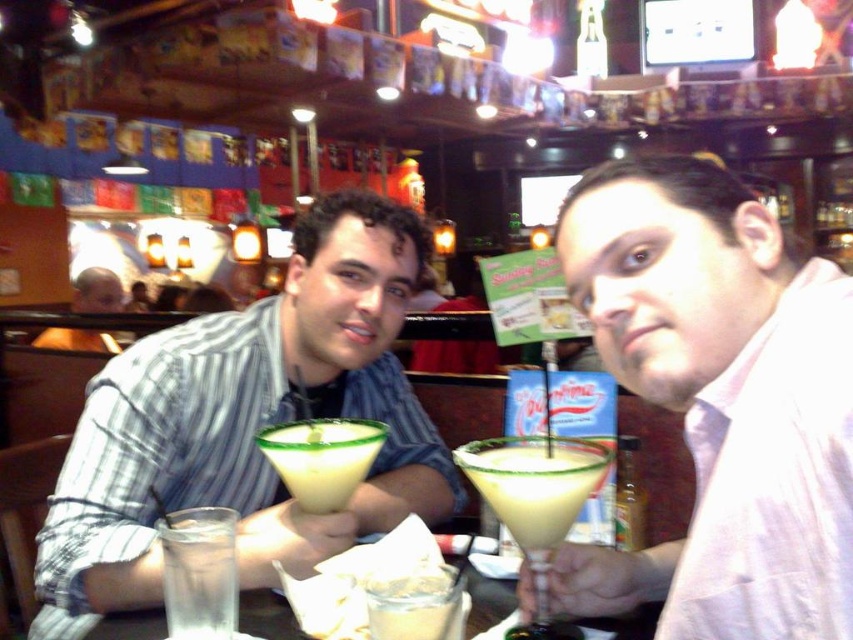
Question: Is yellowish-green liquid at center thinner than clear glass at lower center?

Choices:
 (A) yes
 (B) no

Answer: (A)

Question: Estimate the real-world distances between objects in this image. Which object is closer to the clear glass at lower left?

Choices:
 (A) matte green glass at center
 (B) yellowish-green liquid at center
 (C) translucent glass martini at center

Answer: (B)

Question: Which of these objects is positioned closest to the yellowish-green liquid at center?

Choices:
 (A) clear glass at lower left
 (B) matte pink shirt at center
 (C) matte green glass at center

Answer: (A)

Question: Which of these objects is positioned closest to the yellowish-green liquid at center?

Choices:
 (A) matte pink shirt at center
 (B) clear glass at lower left
 (C) translucent glass martini at center

Answer: (B)

Question: Can you confirm if matte pink shirt at center is positioned below clear glass at lower left?

Choices:
 (A) yes
 (B) no

Answer: (B)

Question: Does clear glass at lower left appear under yellowish-green liquid at center?

Choices:
 (A) no
 (B) yes

Answer: (B)